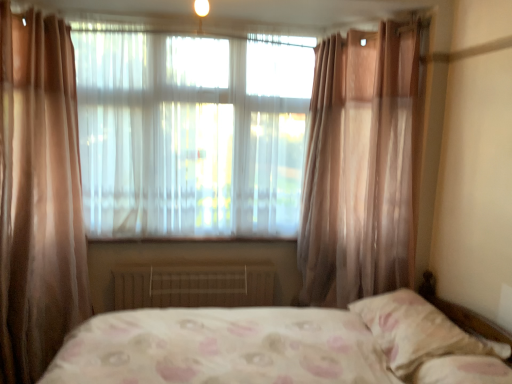
Question: Would you say metallic radiator at center is outside matte white light at upper center?

Choices:
 (A) no
 (B) yes

Answer: (B)

Question: Is metallic radiator at center at the left side of matte white light at upper center?

Choices:
 (A) no
 (B) yes

Answer: (B)

Question: Would you say metallic radiator at center contains matte white light at upper center?

Choices:
 (A) yes
 (B) no

Answer: (B)

Question: Does metallic radiator at center have a lesser height compared to matte white light at upper center?

Choices:
 (A) no
 (B) yes

Answer: (B)

Question: Is metallic radiator at center oriented away from matte white light at upper center?

Choices:
 (A) no
 (B) yes

Answer: (A)

Question: From a real-world perspective, is metallic radiator at center on matte white light at upper center?

Choices:
 (A) yes
 (B) no

Answer: (B)

Question: Considering the relative sizes of translucent fabric window at center and matte white light at upper center in the image provided, is translucent fabric window at center thinner than matte white light at upper center?

Choices:
 (A) no
 (B) yes

Answer: (A)

Question: Considering the relative sizes of translucent fabric window at center and matte white light at upper center in the image provided, is translucent fabric window at center shorter than matte white light at upper center?

Choices:
 (A) no
 (B) yes

Answer: (A)

Question: From the image's perspective, is translucent fabric window at center on matte white light at upper center?

Choices:
 (A) yes
 (B) no

Answer: (B)

Question: Considering the relative sizes of translucent fabric window at center and matte white light at upper center in the image provided, is translucent fabric window at center taller than matte white light at upper center?

Choices:
 (A) no
 (B) yes

Answer: (B)

Question: Is translucent fabric window at center facing away from matte white light at upper center?

Choices:
 (A) no
 (B) yes

Answer: (A)

Question: From the image's perspective, is translucent fabric window at center located beneath matte white light at upper center?

Choices:
 (A) yes
 (B) no

Answer: (A)

Question: Is metallic radiator at center positioned far away from translucent fabric window at center?

Choices:
 (A) yes
 (B) no

Answer: (B)